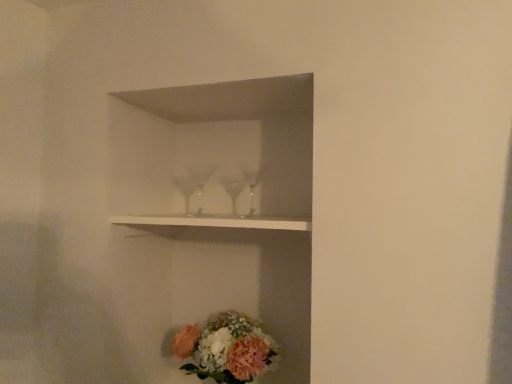
Image resolution: width=512 pixels, height=384 pixels. What do you see at coordinates (225, 348) in the screenshot?
I see `pastel floral bouquet at lower center` at bounding box center [225, 348].

What are the coordinates of `pastel floral bouquet at lower center` in the screenshot? It's located at (225, 348).

Identify the location of white glossy shelf at upper center. The width and height of the screenshot is (512, 384). (216, 221).

Describe the element at coordinates (216, 221) in the screenshot. I see `white glossy shelf at upper center` at that location.

This screenshot has width=512, height=384. I want to click on pastel floral bouquet at lower center, so click(225, 348).

Considering the relative positions of white glossy shelf at upper center and pastel floral bouquet at lower center in the image provided, is white glossy shelf at upper center to the left or to the right of pastel floral bouquet at lower center?

In the image, white glossy shelf at upper center appears on the right side of pastel floral bouquet at lower center.

Does white glossy shelf at upper center come behind pastel floral bouquet at lower center?

No, white glossy shelf at upper center is closer to the viewer.

Considering the points (290, 229) and (226, 352), which point is behind, point (290, 229) or point (226, 352)?

Positioned behind is point (226, 352).

From the image's perspective, which is above, white glossy shelf at upper center or pastel floral bouquet at lower center?

From the image's view, white glossy shelf at upper center is above.

From a real-world perspective, which object rests below the other?

From a 3D spatial view, pastel floral bouquet at lower center is below.

Looking at their sizes, would you say white glossy shelf at upper center is wider or thinner than pastel floral bouquet at lower center?

In the image, white glossy shelf at upper center appears to be wider than pastel floral bouquet at lower center.

Is white glossy shelf at upper center taller than pastel floral bouquet at lower center?

No, white glossy shelf at upper center is not taller than pastel floral bouquet at lower center.

Between white glossy shelf at upper center and pastel floral bouquet at lower center, which one has smaller size?

white glossy shelf at upper center is smaller.

Is white glossy shelf at upper center inside or outside of pastel floral bouquet at lower center?

white glossy shelf at upper center is not inside pastel floral bouquet at lower center, it's outside.

Is white glossy shelf at upper center not close to pastel floral bouquet at lower center?

No, there isn't a large distance between white glossy shelf at upper center and pastel floral bouquet at lower center.

Is white glossy shelf at upper center facing away from pastel floral bouquet at lower center?

That's not correct — white glossy shelf at upper center is not looking away from pastel floral bouquet at lower center.

What's the angular difference between white glossy shelf at upper center and pastel floral bouquet at lower center's facing directions?

The angle between the facing direction of white glossy shelf at upper center and the facing direction of pastel floral bouquet at lower center is 2.2 degrees.

The width and height of the screenshot is (512, 384). I want to click on shelf that appears above the pastel floral bouquet at lower center (from a real-world perspective), so click(x=216, y=221).

Is pastel floral bouquet at lower center to the left of white glossy shelf at upper center from the viewer's perspective?

Yes, pastel floral bouquet at lower center is to the left of white glossy shelf at upper center.

Considering the relative positions of pastel floral bouquet at lower center and white glossy shelf at upper center in the image provided, is pastel floral bouquet at lower center behind white glossy shelf at upper center?

Yes, it is.

Which is in front, point (202, 352) or point (210, 218)?

The point (210, 218) is more forward.

From the image's perspective, relative to white glossy shelf at upper center, is pastel floral bouquet at lower center above or below?

pastel floral bouquet at lower center is below white glossy shelf at upper center.

From the picture: From a real-world perspective, is pastel floral bouquet at lower center above or below white glossy shelf at upper center?

In terms of real-world spatial position, pastel floral bouquet at lower center is below white glossy shelf at upper center.

Does pastel floral bouquet at lower center have a lesser width compared to white glossy shelf at upper center?

Yes.

Does pastel floral bouquet at lower center have a greater height compared to white glossy shelf at upper center?

Yes.

Based on the photo, can you confirm if pastel floral bouquet at lower center is bigger than white glossy shelf at upper center?

Yes, pastel floral bouquet at lower center is bigger than white glossy shelf at upper center.

Which is correct: pastel floral bouquet at lower center is inside white glossy shelf at upper center, or outside of it?

pastel floral bouquet at lower center is located beyond the bounds of white glossy shelf at upper center.

Is pastel floral bouquet at lower center beside white glossy shelf at upper center?

No, pastel floral bouquet at lower center is not next to white glossy shelf at upper center.

Is pastel floral bouquet at lower center aimed at white glossy shelf at upper center?

No, pastel floral bouquet at lower center is not facing towards white glossy shelf at upper center.

Can you tell me how much pastel floral bouquet at lower center and white glossy shelf at upper center differ in facing direction?

The angular difference between pastel floral bouquet at lower center and white glossy shelf at upper center is 2.2 degrees.

Measure the distance between pastel floral bouquet at lower center and white glossy shelf at upper center.

A distance of 38.07 centimeters exists between pastel floral bouquet at lower center and white glossy shelf at upper center.

This screenshot has width=512, height=384. Find the location of `shelf that appears on the right of pastel floral bouquet at lower center`. shelf that appears on the right of pastel floral bouquet at lower center is located at coordinates (216, 221).

The height and width of the screenshot is (384, 512). I want to click on flower on the left side of white glossy shelf at upper center, so click(225, 348).

Image resolution: width=512 pixels, height=384 pixels. In order to click on shelf lying in front of the pastel floral bouquet at lower center in this screenshot , I will do `click(216, 221)`.